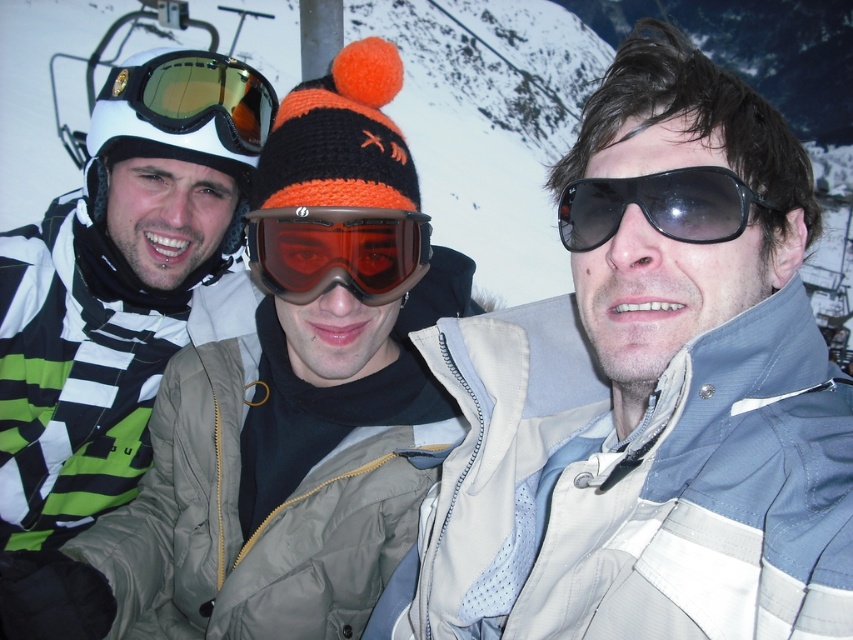
Question: Which point is farther to the camera?

Choices:
 (A) gold reflective lens goggles at upper left
 (B) translucent orange ski goggles at center
 (C) black matte sunglasses at center

Answer: (A)

Question: From the image, what is the correct spatial relationship of gold reflective lens goggles at upper left in relation to black matte sunglasses at center?

Choices:
 (A) right
 (B) left

Answer: (B)

Question: Which point is farther from the camera taking this photo?

Choices:
 (A) (563, 230)
 (B) (282, 284)
 (C) (148, 106)

Answer: (C)

Question: Estimate the real-world distances between objects in this image. Which object is closer to the gold reflective lens goggles at upper left?

Choices:
 (A) translucent orange ski goggles at center
 (B) black matte sunglasses at center

Answer: (A)

Question: Can you confirm if gold reflective lens goggles at upper left is thinner than black matte sunglasses at center?

Choices:
 (A) no
 (B) yes

Answer: (A)

Question: Does gold reflective lens goggles at upper left appear under black matte sunglasses at center?

Choices:
 (A) yes
 (B) no

Answer: (B)